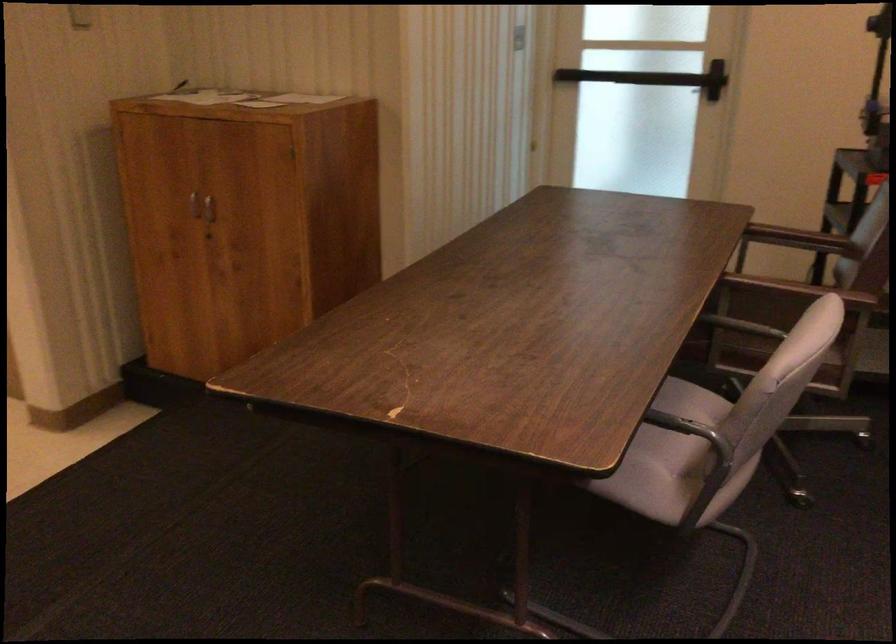
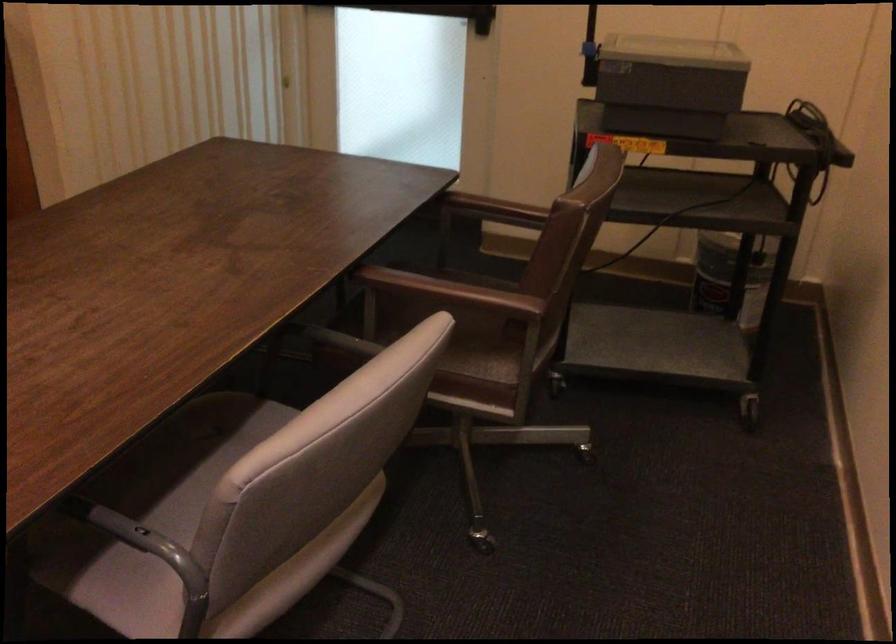
In the second image, find the point that corresponds to pixel 673 421 in the first image.

(140, 538)